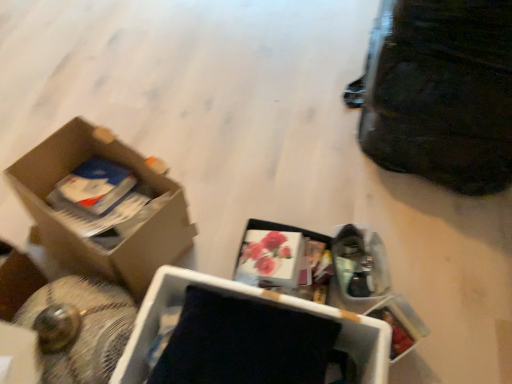
Question: Would you consider cardboard box at left, acting as the 2th box starting from the right, to be distant from black leather bag at upper right?

Choices:
 (A) no
 (B) yes

Answer: (A)

Question: Considering the relative sizes of cardboard box at left, placed as the first box when sorted from left to right, and black leather bag at upper right in the image provided, is cardboard box at left, placed as the first box when sorted from left to right, bigger than black leather bag at upper right?

Choices:
 (A) yes
 (B) no

Answer: (B)

Question: Is cardboard box at left, placed as the first box when sorted from left to right, facing towards black leather bag at upper right?

Choices:
 (A) no
 (B) yes

Answer: (B)

Question: Is black leather bag at upper right located within cardboard box at left, placed as the first box when sorted from left to right?

Choices:
 (A) yes
 (B) no

Answer: (B)

Question: Can you confirm if cardboard box at left, acting as the 2th box starting from the right, is positioned to the left of black leather bag at upper right?

Choices:
 (A) yes
 (B) no

Answer: (A)

Question: In the image, is black leather bag at upper right on the left side or the right side of black matte box at center, acting as the first box starting from the right?

Choices:
 (A) right
 (B) left

Answer: (A)

Question: Looking at their shapes, would you say black leather bag at upper right is wider or thinner than black matte box at center, which is the second box from left to right?

Choices:
 (A) thin
 (B) wide

Answer: (B)

Question: Considering the positions of black leather bag at upper right and black matte box at center, which is the second box from left to right, in the image, is black leather bag at upper right taller or shorter than black matte box at center, which is the second box from left to right,?

Choices:
 (A) short
 (B) tall

Answer: (B)

Question: From the image's perspective, is black leather bag at upper right above or below black matte box at center, which is the second box from left to right?

Choices:
 (A) above
 (B) below

Answer: (A)

Question: From a real-world perspective, is black matte box at center, which is the second box from left to right, physically located above or below black leather bag at upper right?

Choices:
 (A) above
 (B) below

Answer: (B)

Question: Is black matte box at center, acting as the first box starting from the right, bigger or smaller than black leather bag at upper right?

Choices:
 (A) big
 (B) small

Answer: (B)

Question: Relative to black leather bag at upper right, is black matte box at center, which is the second box from left to right, in front or behind?

Choices:
 (A) front
 (B) behind

Answer: (A)

Question: From the image's perspective, is black matte box at center, acting as the first box starting from the right, positioned above or below black leather bag at upper right?

Choices:
 (A) above
 (B) below

Answer: (B)

Question: Is point pos(49,190) positioned closer to the camera than point pos(189,347)?

Choices:
 (A) closer
 (B) farther

Answer: (B)

Question: Considering the positions of cardboard box at left, placed as the first box when sorted from left to right, and black matte box at center, acting as the first box starting from the right, in the image, is cardboard box at left, placed as the first box when sorted from left to right, taller or shorter than black matte box at center, acting as the first box starting from the right,?

Choices:
 (A) short
 (B) tall

Answer: (B)